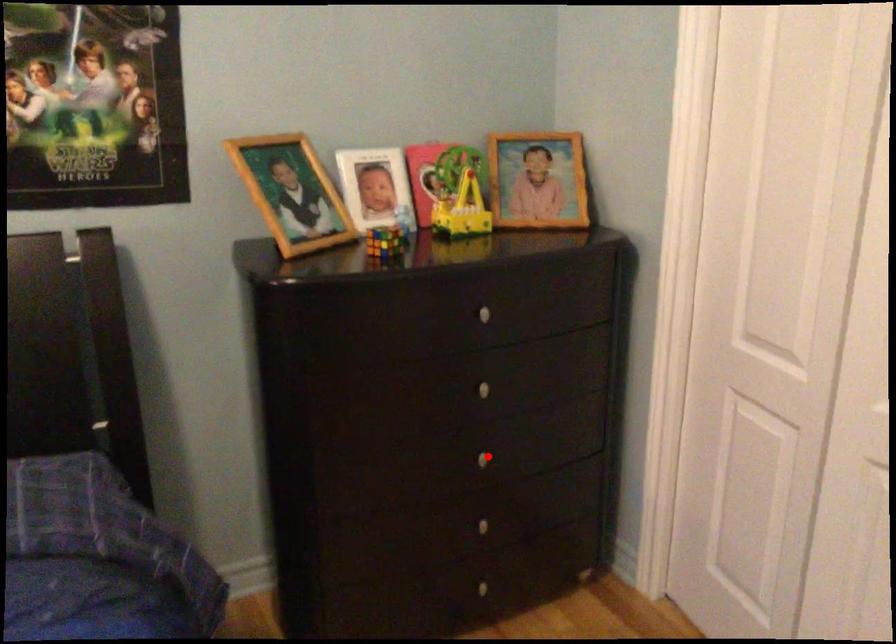
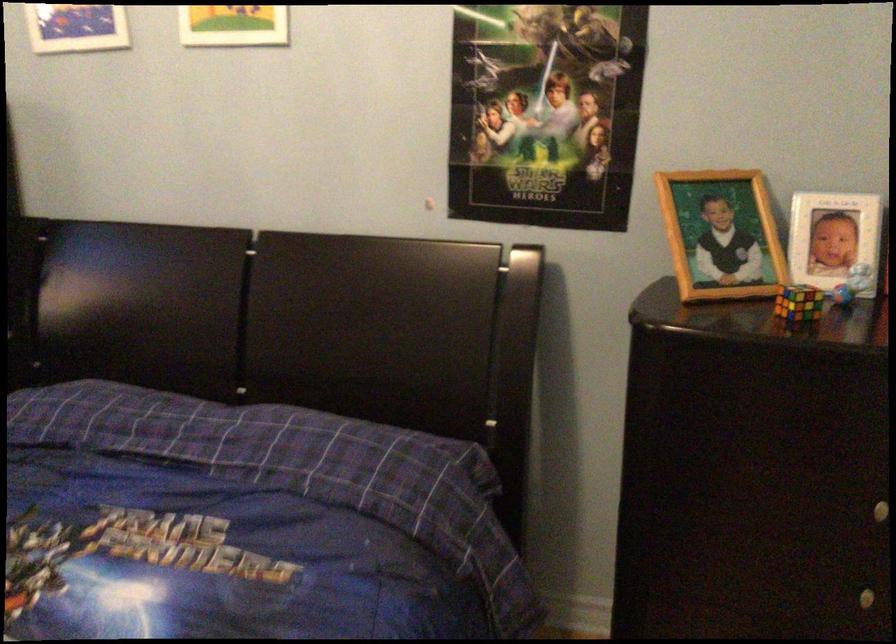
Question: I am providing you with two images of the same scene from different viewpoints. In image1, a red point is highlighted. Considering the same 3D point in image2, which of the following is correct?

Choices:
 (A) It is closer
 (B) It is farther

Answer: (A)